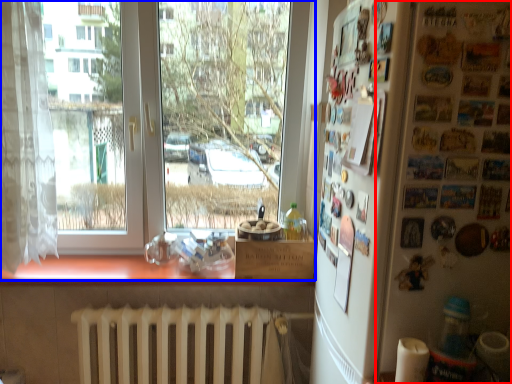
Question: Which point is closer to the camera, bulletin board (highlighted by a red box) or window (highlighted by a blue box)?

Choices:
 (A) bulletin board
 (B) window

Answer: (A)